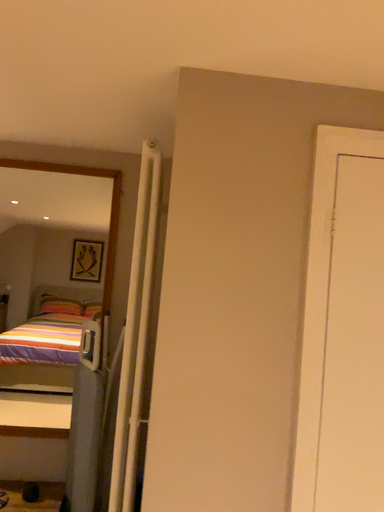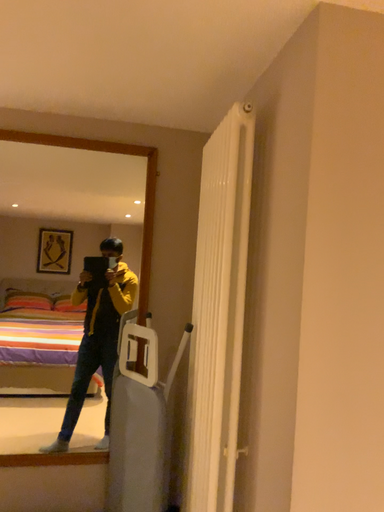
Question: Which way did the camera rotate in the video?

Choices:
 (A) rotated left
 (B) rotated right

Answer: (B)